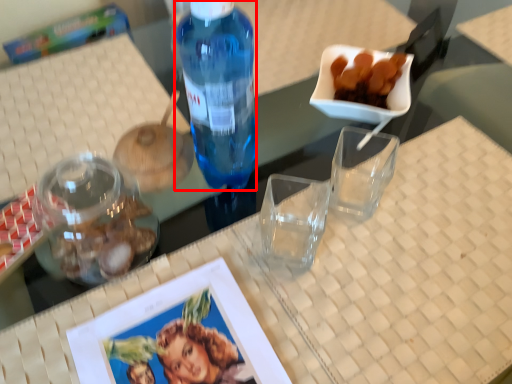
Question: Considering the relative positions of bottle (annotated by the red box) and tableware in the image provided, where is bottle (annotated by the red box) located with respect to the staircase?

Choices:
 (A) left
 (B) right

Answer: (B)